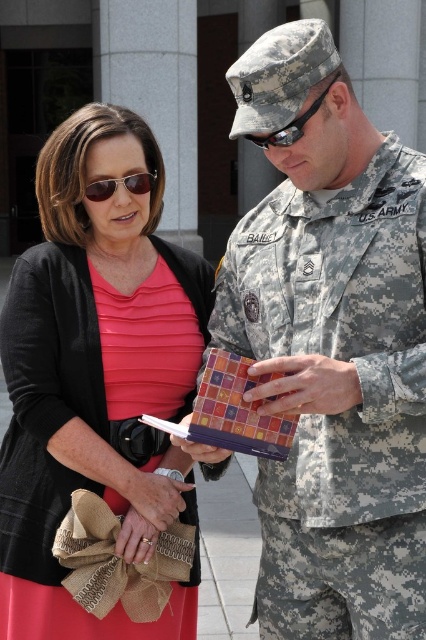
Is camouflage uniform at center bigger than matte black clutch at left?

Indeed, camouflage uniform at center has a larger size compared to matte black clutch at left.

Is point (282, 339) positioned behind point (14, 499)?

No.

What are the coordinates of `camouflage uniform at center` in the screenshot? It's located at (331, 346).

Is matte black clutch at left bigger than matte black sunglasses at upper left?

Indeed, matte black clutch at left has a larger size compared to matte black sunglasses at upper left.

Which is behind, point (175, 509) or point (100, 182)?

Point (100, 182)

You are a GUI agent. You are given a task and a screenshot of the screen. Output one action in this format:
    pyautogui.click(x=<x>, y=<y>)
    Task: Click on the matte black clutch at left
    The width and height of the screenshot is (426, 640).
    Given the screenshot: What is the action you would take?
    pyautogui.click(x=100, y=390)

Is point (0, 483) positioned before point (316, 106)?

No, it is not.

Measure the distance between point (109, 257) and camera.

Point (109, 257) and camera are 3.47 meters apart from each other.

Does point (68, 291) lie in front of point (299, 134)?

No, (68, 291) is further to viewer.

Locate an element on the screen. The height and width of the screenshot is (640, 426). matte black clutch at left is located at coordinates (100, 390).